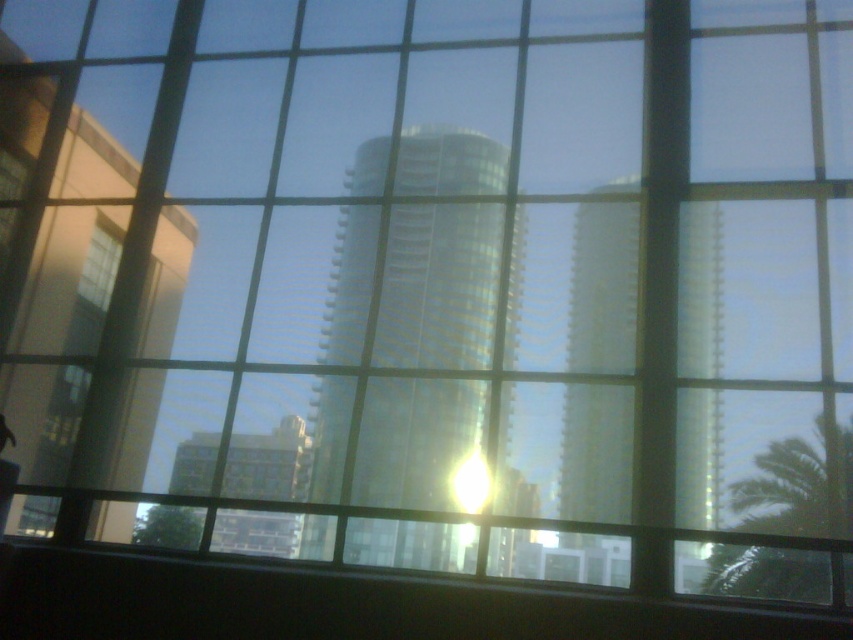
Which is behind, point (412, 141) or point (793, 572)?

Point (412, 141)

From the picture: Can you confirm if shiny glass tower at center is positioned below green leafy palm tree at lower right?

Actually, shiny glass tower at center is above green leafy palm tree at lower right.

Between point (427, 381) and point (770, 451), which one is positioned behind?

The point (427, 381) is behind.

Locate an element on the screen. This screenshot has width=853, height=640. shiny glass tower at center is located at coordinates (438, 285).

Is shiny glass tower at center in front of reflective glass tower at center?

No, it is not.

Between shiny glass tower at center and reflective glass tower at center, which one appears on the right side from the viewer's perspective?

reflective glass tower at center is more to the right.

Is point (426, 484) behind point (636, 355)?

No, (426, 484) is closer to viewer.

Locate an element on the screen. shiny glass tower at center is located at coordinates tap(438, 285).

Is point (607, 211) positioned after point (792, 563)?

That is True.

Between point (688, 326) and point (837, 449), which one is positioned behind?

Positioned behind is point (688, 326).

Is point (637, 225) positioned in front of point (820, 422)?

No.

The height and width of the screenshot is (640, 853). What are the coordinates of `reflective glass tower at center` in the screenshot? It's located at 604,289.